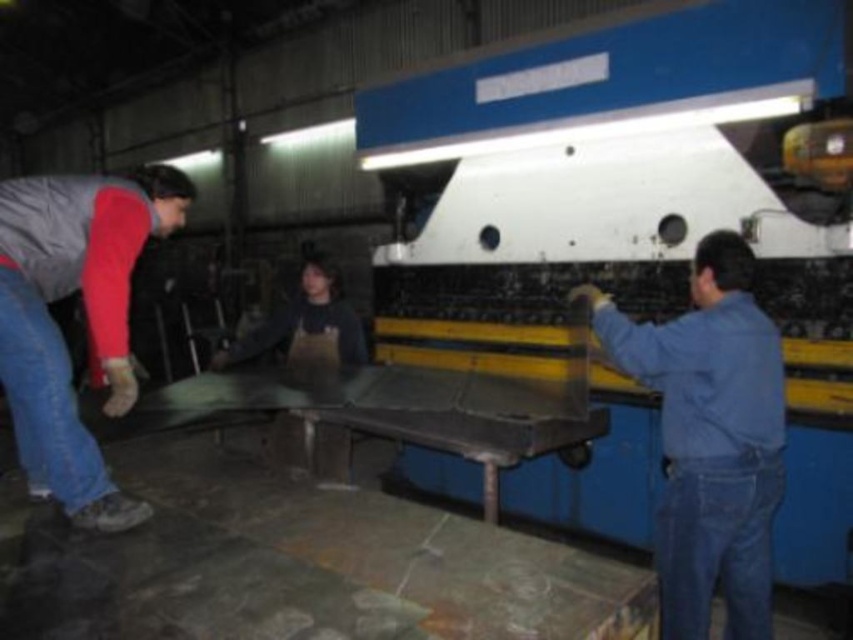
Question: Which point appears farthest from the camera in this image?

Choices:
 (A) (653, 339)
 (B) (32, 356)
 (C) (718, 534)

Answer: (A)

Question: Where is blue denim jumpsuit at right located in relation to denim at right in the image?

Choices:
 (A) below
 (B) above

Answer: (B)

Question: Which of these objects is positioned closest to the blue denim jumpsuit at right?

Choices:
 (A) gray/red jacket at left
 (B) blue denim jeans at lower left

Answer: (A)

Question: Which point appears farthest from the camera in this image?

Choices:
 (A) (115, 396)
 (B) (44, 406)
 (C) (779, 435)
 (D) (662, 552)

Answer: (A)

Question: Is gray/red jacket at left to the left of blue denim jeans at lower left from the viewer's perspective?

Choices:
 (A) yes
 (B) no

Answer: (B)

Question: Is gray/red jacket at left in front of denim at right?

Choices:
 (A) yes
 (B) no

Answer: (A)